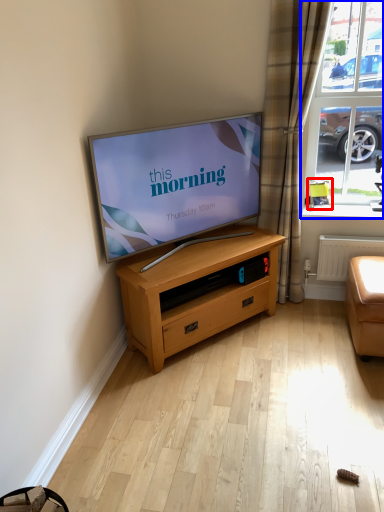
Question: Which object is further to the camera taking this photo, armchair (highlighted by a red box) or window (highlighted by a blue box)?

Choices:
 (A) armchair
 (B) window

Answer: (A)